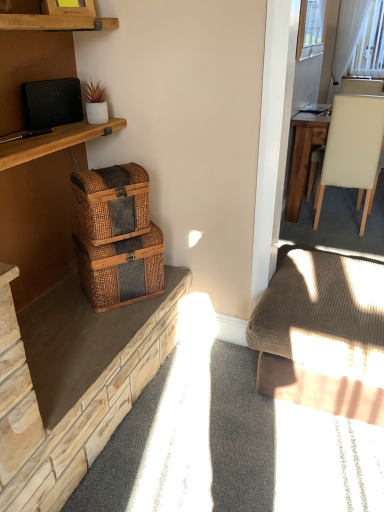
At what (x,y) coordinates should I click in order to perform the action: click on free spot above ribbed brown fabric couch at lower right (from a real-world perspective). Please return your answer as a coordinate pair (x, y). Image resolution: width=384 pixels, height=512 pixels. Looking at the image, I should click on [x=321, y=280].